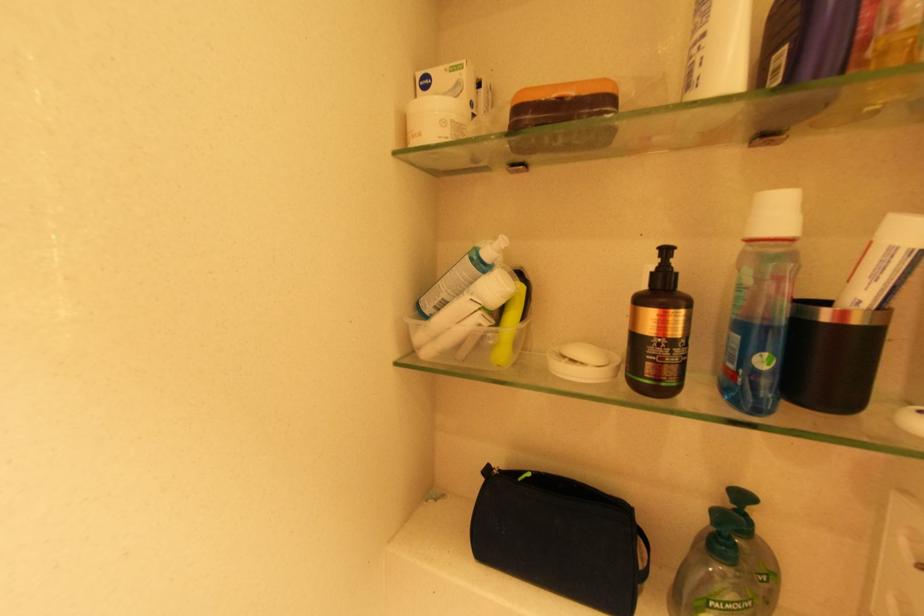
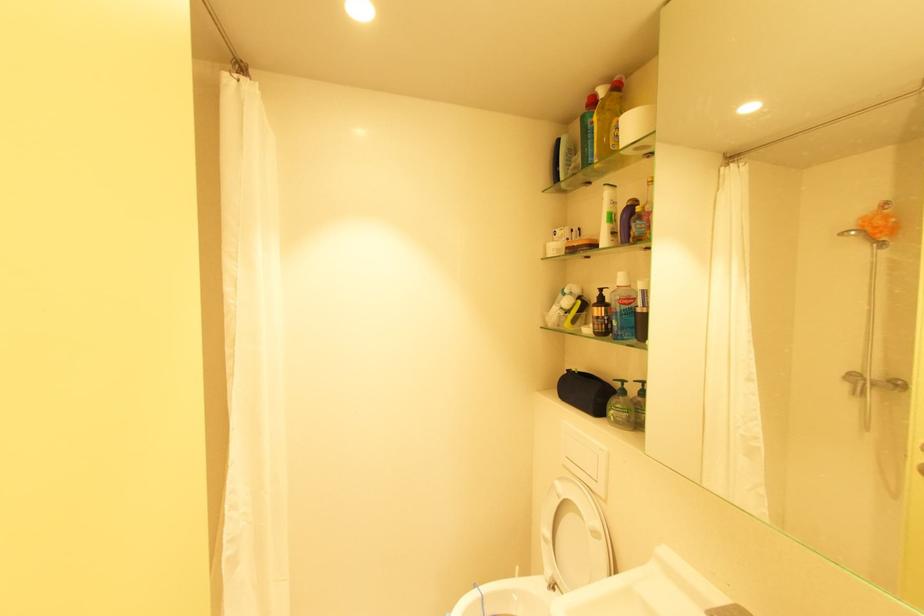
Where in the second image is the point corresponding to (672,252) from the first image?

(606, 291)